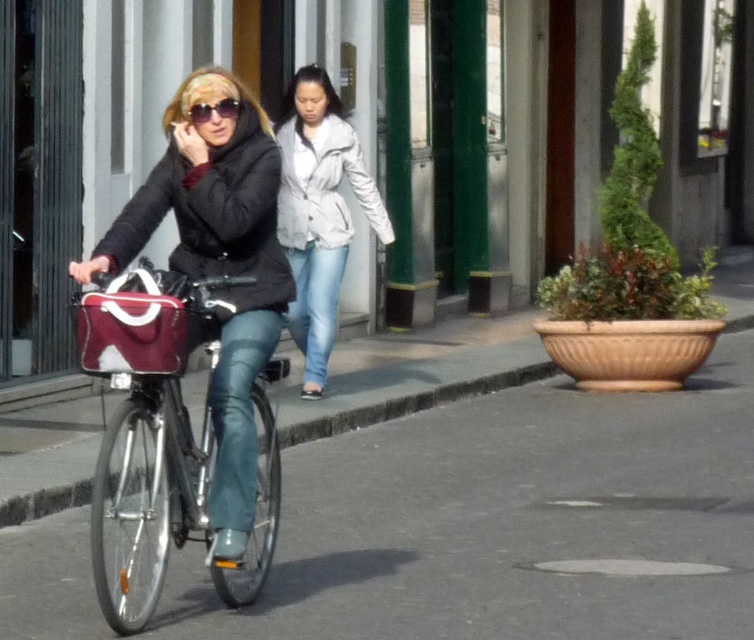
Is shiny metallic bicycle at left smaller than maroon fabric bag at left?

No, shiny metallic bicycle at left is not smaller than maroon fabric bag at left.

Can you confirm if shiny metallic bicycle at left is positioned above maroon fabric bag at left?

Incorrect, shiny metallic bicycle at left is not positioned above maroon fabric bag at left.

You are a GUI agent. You are given a task and a screenshot of the screen. Output one action in this format:
    pyautogui.click(x=<x>, y=<y>)
    Task: Click on the shiny metallic bicycle at left
    The image size is (754, 640).
    Given the screenshot: What is the action you would take?
    pyautogui.click(x=149, y=419)

Where is `shiny metallic bicycle at left`? shiny metallic bicycle at left is located at coordinates (149, 419).

Which is above, shiny metallic bicycle at left or matte black sunglasses at upper center?

matte black sunglasses at upper center is above.

Where is `shiny metallic bicycle at left`? This screenshot has height=640, width=754. shiny metallic bicycle at left is located at coordinates (149, 419).

Locate an element on the screen. The height and width of the screenshot is (640, 754). shiny metallic bicycle at left is located at coordinates (149, 419).

Between light gray textured jacket at center and matte black sunglasses at upper center, which one has less height?

matte black sunglasses at upper center is shorter.

Is light gray textured jacket at center positioned in front of matte black sunglasses at upper center?

No, it is behind matte black sunglasses at upper center.

In order to click on light gray textured jacket at center in this screenshot , I will do `click(319, 212)`.

Where is `light gray textured jacket at center`? light gray textured jacket at center is located at coordinates (319, 212).